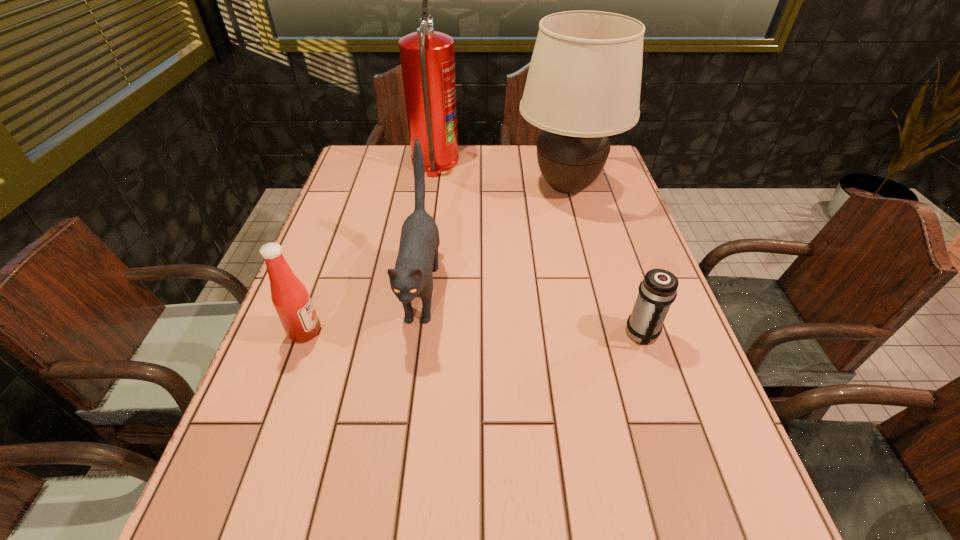
The image size is (960, 540). In order to click on fire extinguisher in this screenshot , I will do `click(427, 57)`.

Find the location of `lampshade`. lampshade is located at coordinates (583, 85).

Where is `cat`? The height and width of the screenshot is (540, 960). cat is located at coordinates (412, 277).

At what (x,y) coordinates should I click in order to perform the action: click on the second shortest object. Please return your answer as a coordinate pair (x, y). Looking at the image, I should click on click(289, 295).

You are a GUI agent. You are given a task and a screenshot of the screen. Output one action in this format:
    pyautogui.click(x=<x>, y=<y>)
    Task: Click on the leftmost object
    The width and height of the screenshot is (960, 540).
    Given the screenshot: What is the action you would take?
    pyautogui.click(x=289, y=295)

The width and height of the screenshot is (960, 540). Find the location of `thermos bottle`. thermos bottle is located at coordinates (658, 290).

Where is `free space located on the instruction side of the fire extinguisher`? free space located on the instruction side of the fire extinguisher is located at coordinates (525, 163).

Locate an element on the screen. The height and width of the screenshot is (540, 960). blank area located on the front of the lampshade is located at coordinates (577, 230).

Identify the location of free location located 0.330m at the face of the third tallest object. (390, 527).

Find the location of a particular element. free space located on the front-facing side of the fourth tallest object is located at coordinates (473, 332).